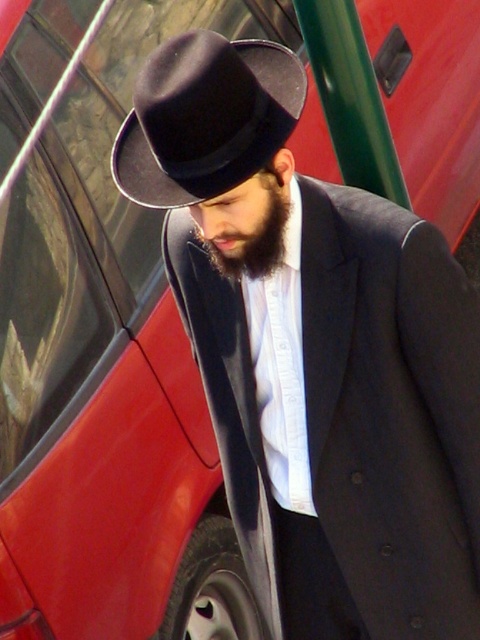
Question: Is matte black hat at center to the right of black felt fedora at center from the viewer's perspective?

Choices:
 (A) yes
 (B) no

Answer: (A)

Question: Estimate the real-world distances between objects in this image. Which object is closer to the dark brown fuzzy beard at center?

Choices:
 (A) black felt fedora at center
 (B) matte black hat at center

Answer: (A)

Question: Is matte black hat at center below black felt fedora at center?

Choices:
 (A) no
 (B) yes

Answer: (B)

Question: Which object is farther from the camera taking this photo?

Choices:
 (A) black felt fedora at center
 (B) matte black hat at center

Answer: (B)

Question: Is matte black hat at center thinner than black felt fedora at center?

Choices:
 (A) no
 (B) yes

Answer: (A)

Question: Among these objects, which one is farthest from the camera?

Choices:
 (A) dark brown fuzzy beard at center
 (B) black felt fedora at center

Answer: (A)